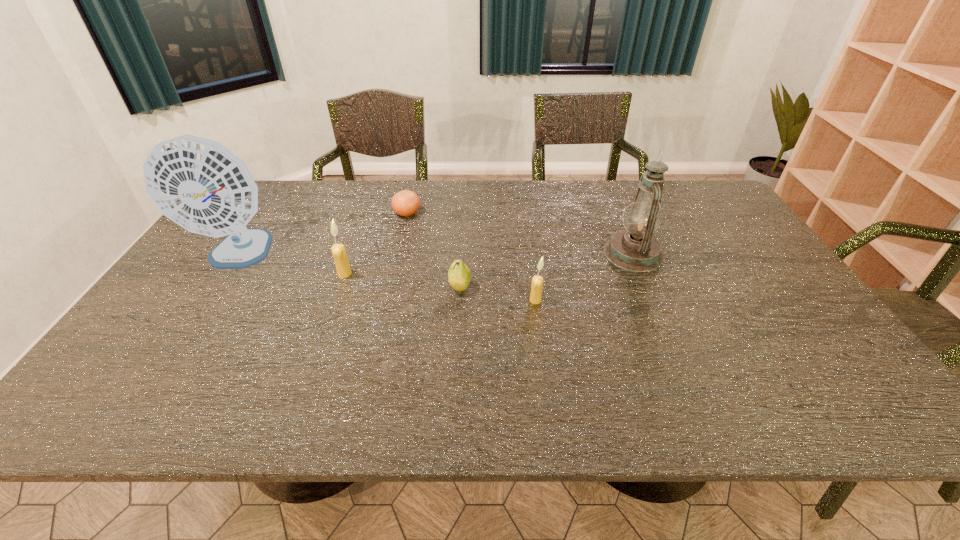
Where is `free space between the oil lamp and the clementine`? Image resolution: width=960 pixels, height=540 pixels. free space between the oil lamp and the clementine is located at coordinates (520, 233).

The width and height of the screenshot is (960, 540). I want to click on free space between the fourth tallest object and the second object from left to right, so click(x=440, y=287).

The width and height of the screenshot is (960, 540). I want to click on object identified as the closest to the shortest object, so click(x=338, y=250).

Select which object appears as the closest to the rightmost object. Please provide its 2D coordinates. Your answer should be formatted as a tuple, i.e. [(x, y)], where the tuple contains the x and y coordinates of a point satisfying the conditions above.

[(537, 281)]

Find the location of a particular element. This screenshot has height=540, width=960. blank space that satisfies the following two spatial constraints: 1. on the front side of the nearer candle; 2. on the right side of the farther candle is located at coordinates (335, 300).

At what (x,y) coordinates should I click in order to perform the action: click on vacant space that satisfies the following two spatial constraints: 1. on the grille of the leftmost object; 2. on the left side of the pear. Please return your answer as a coordinate pair (x, y). Looking at the image, I should click on (217, 288).